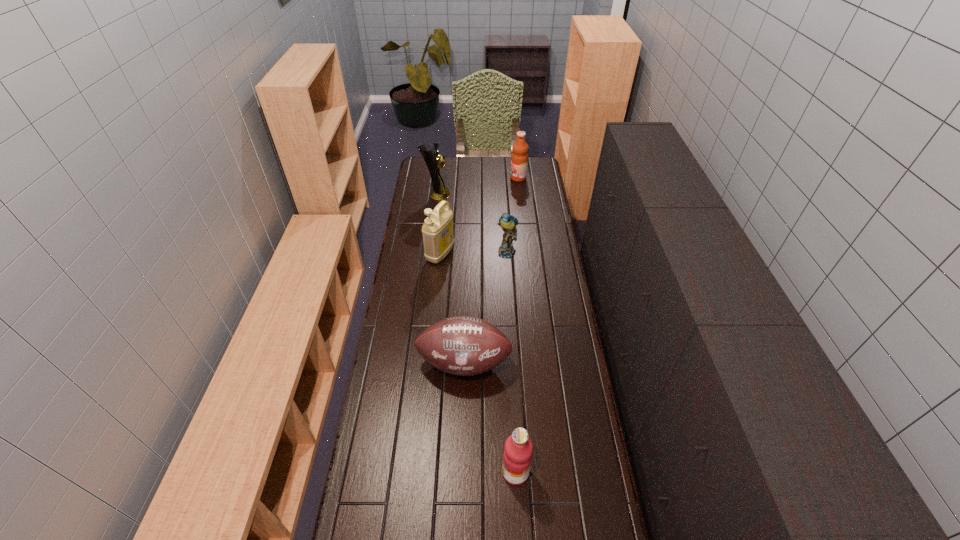
Identify the location of award. (432, 157).

Where is `detergent`? detergent is located at coordinates coord(438,237).

At what (x,y) coordinates should I click in order to perform the action: click on the farthest object. Please return your answer as a coordinate pair (x, y). The width and height of the screenshot is (960, 540). Looking at the image, I should click on (519, 159).

Where is `the farther fruit juice`? the farther fruit juice is located at coordinates (519, 159).

Identify the location of parrot. This screenshot has width=960, height=540. (507, 222).

Where is `the left fruit juice`? The image size is (960, 540). the left fruit juice is located at coordinates (517, 456).

You are a GUI agent. You are given a task and a screenshot of the screen. Output one action in this format:
    pyautogui.click(x=<x>, y=<y>)
    Task: Click on the nearer fruit juice
    
    Given the screenshot: What is the action you would take?
    pyautogui.click(x=517, y=456)

You are a GUI agent. You are given a task and a screenshot of the screen. Output one action in this format:
    pyautogui.click(x=<x>, y=<y>)
    Task: Click on the football (American)
    
    Given the screenshot: What is the action you would take?
    pyautogui.click(x=462, y=345)

Where is `free space located at the front of the award, where the globe is visible`? The height and width of the screenshot is (540, 960). free space located at the front of the award, where the globe is visible is located at coordinates pos(491,194).

Identify the location of vacant space located on the front of the detergent. The image size is (960, 540). (434, 325).